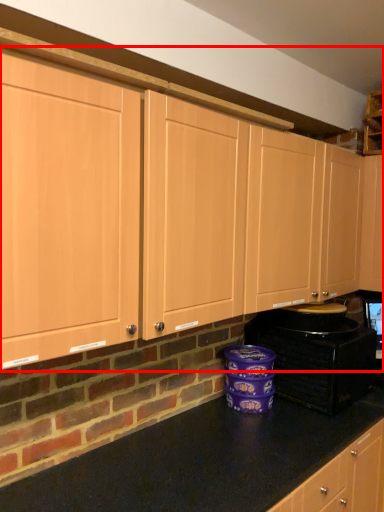
Question: From the image's perspective, where is cabinetry (annotated by the red box) located in relation to home appliance in the image?

Choices:
 (A) below
 (B) above

Answer: (B)